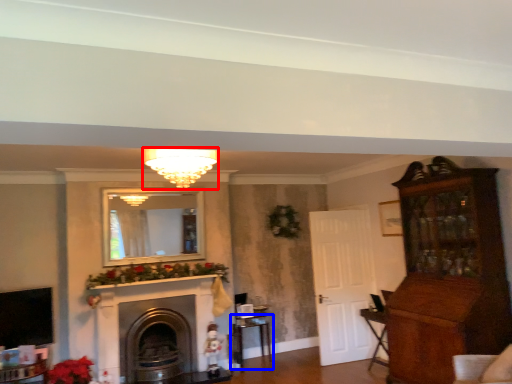
Question: Which object appears closest to the camera in this image, light fixture (highlighted by a red box) or table (highlighted by a blue box)?

Choices:
 (A) light fixture
 (B) table

Answer: (A)